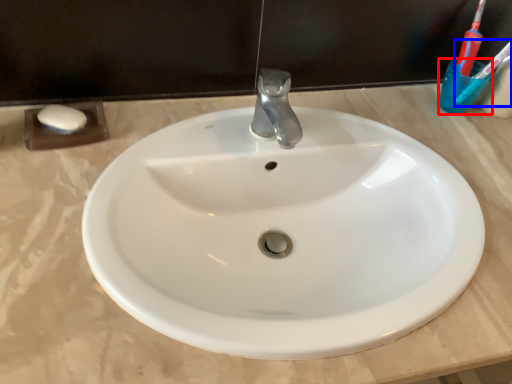
Question: Which point is further to the camera, liquid (highlighted by a red box) or toothbrush (highlighted by a blue box)?

Choices:
 (A) liquid
 (B) toothbrush

Answer: (A)